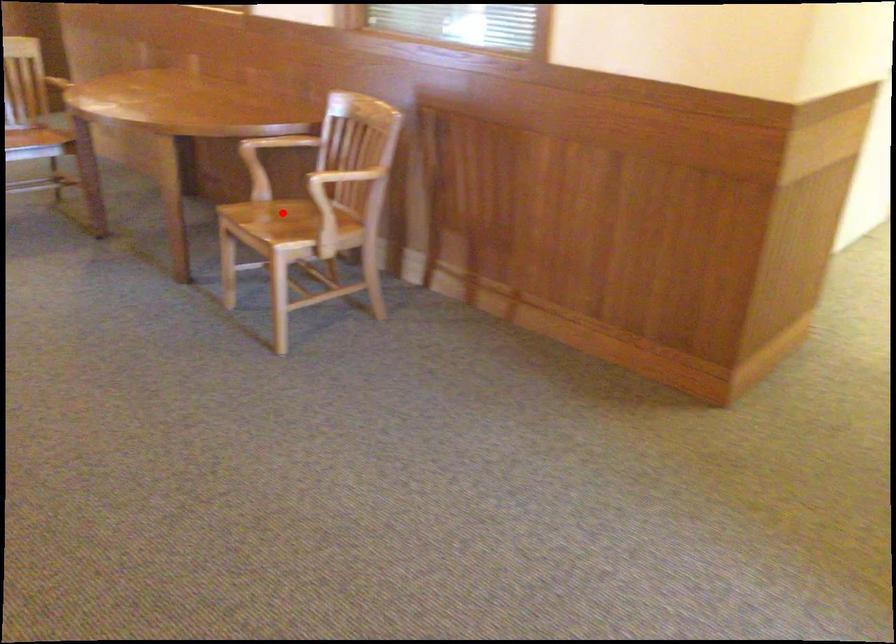
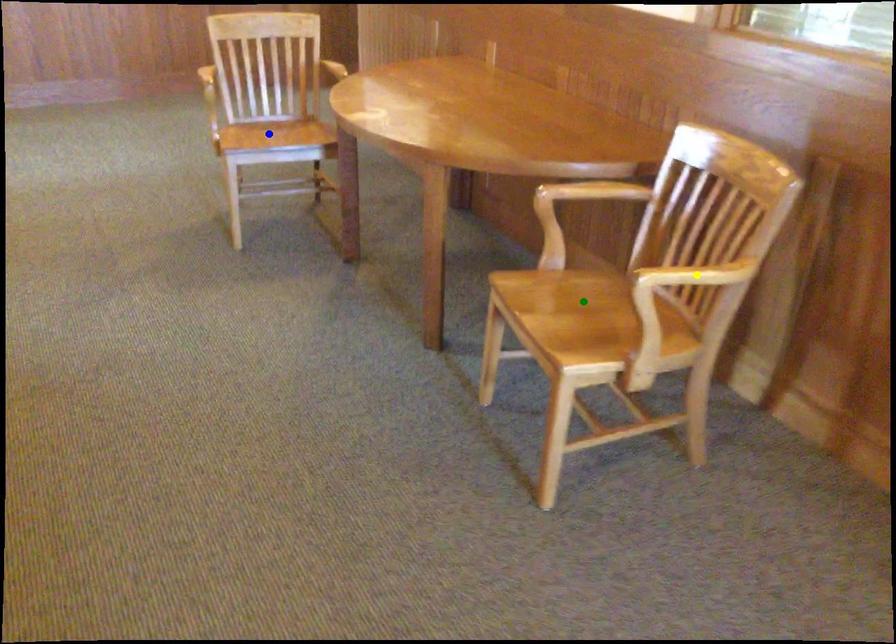
Question: I am providing you with two images of the same scene from different viewpoints. A red point is marked on the first image. You are given multiple points on the second image. In image 2, which mark is for the same physical point as the one in image 1?

Choices:
 (A) yellow point
 (B) blue point
 (C) green point

Answer: (C)